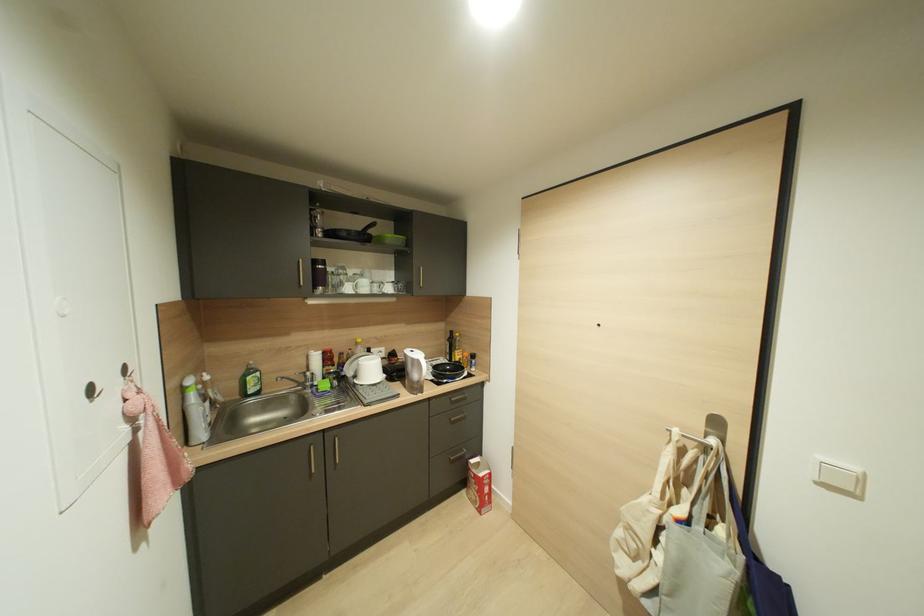
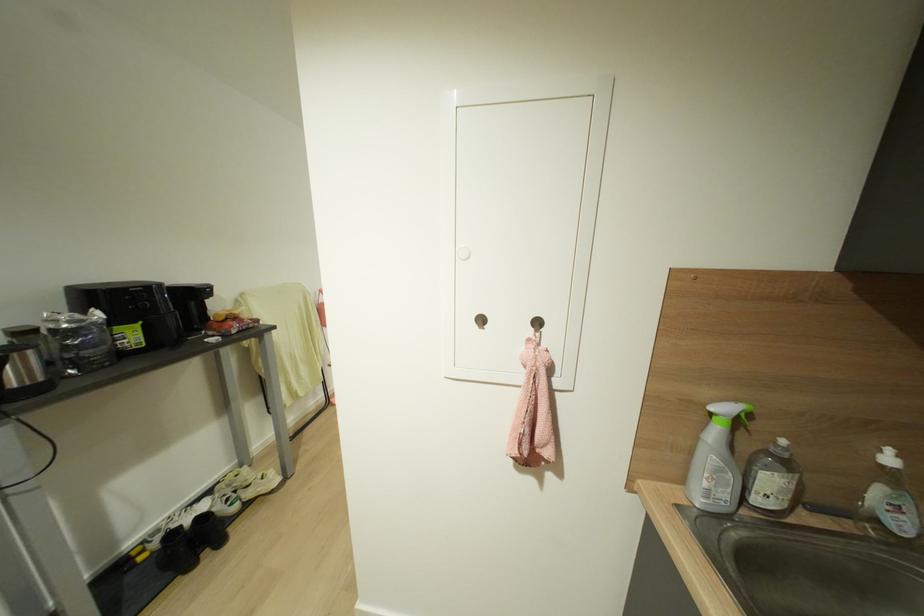
Find the pixel in the second image that matches the point at 183,389 in the first image.

(711, 411)